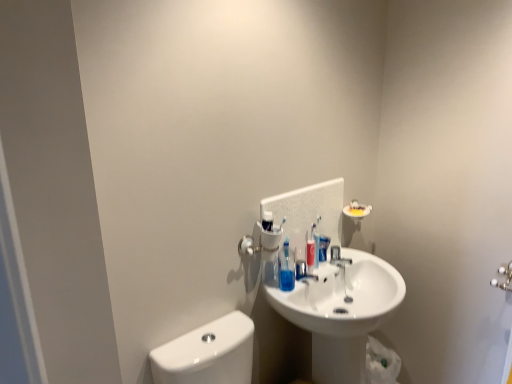
Question: From a real-world perspective, is satin nickel faucet at center under white glossy sink at center?

Choices:
 (A) no
 (B) yes

Answer: (A)

Question: Considering the relative sizes of satin nickel faucet at center and white glossy sink at center in the image provided, is satin nickel faucet at center taller than white glossy sink at center?

Choices:
 (A) no
 (B) yes

Answer: (A)

Question: Considering the relative sizes of satin nickel faucet at center and white glossy sink at center in the image provided, is satin nickel faucet at center shorter than white glossy sink at center?

Choices:
 (A) yes
 (B) no

Answer: (A)

Question: Does satin nickel faucet at center lie in front of white glossy sink at center?

Choices:
 (A) yes
 (B) no

Answer: (B)

Question: From the image's perspective, is satin nickel faucet at center under white glossy sink at center?

Choices:
 (A) no
 (B) yes

Answer: (A)

Question: From a real-world perspective, is satin nickel faucet at center on white glossy sink at center?

Choices:
 (A) no
 (B) yes

Answer: (B)

Question: Does satin nickel faucet at center have a greater width compared to blue glossy mouthwash at center?

Choices:
 (A) yes
 (B) no

Answer: (A)

Question: Would you consider satin nickel faucet at center to be distant from blue glossy mouthwash at center?

Choices:
 (A) yes
 (B) no

Answer: (B)

Question: Can you confirm if satin nickel faucet at center is thinner than blue glossy mouthwash at center?

Choices:
 (A) no
 (B) yes

Answer: (A)

Question: Could you tell me if satin nickel faucet at center is facing blue glossy mouthwash at center?

Choices:
 (A) no
 (B) yes

Answer: (A)

Question: Considering the relative sizes of satin nickel faucet at center and blue glossy mouthwash at center in the image provided, is satin nickel faucet at center taller than blue glossy mouthwash at center?

Choices:
 (A) yes
 (B) no

Answer: (B)

Question: From a real-world perspective, is satin nickel faucet at center positioned over blue glossy mouthwash at center based on gravity?

Choices:
 (A) no
 (B) yes

Answer: (A)

Question: Is satin nickel faucet at center taller than translucent plastic soap dispenser at center?

Choices:
 (A) no
 (B) yes

Answer: (A)